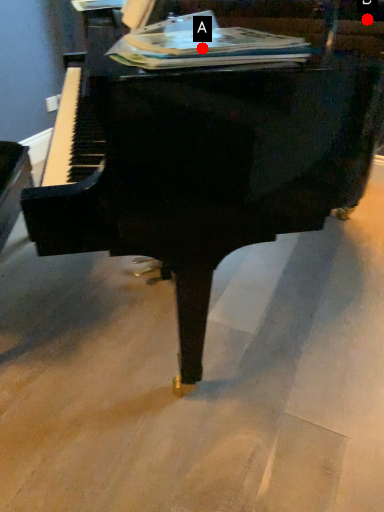
Question: Two points are circled on the image, labeled by A and B beside each circle. Which point is farther to the camera?

Choices:
 (A) A is further
 (B) B is further

Answer: (B)